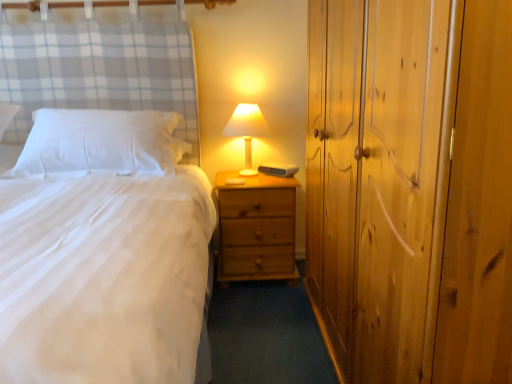
Question: From a real-world perspective, is wooden dresser at right physically above white soft pillow at left?

Choices:
 (A) no
 (B) yes

Answer: (A)

Question: Considering the relative sizes of wooden dresser at right and white soft pillow at left in the image provided, is wooden dresser at right taller than white soft pillow at left?

Choices:
 (A) no
 (B) yes

Answer: (B)

Question: Considering the relative positions of wooden dresser at right and white soft pillow at left in the image provided, is wooden dresser at right in front of white soft pillow at left?

Choices:
 (A) yes
 (B) no

Answer: (A)

Question: From the image's perspective, would you say wooden dresser at right is positioned over white soft pillow at left?

Choices:
 (A) no
 (B) yes

Answer: (A)

Question: Considering the relative sizes of wooden dresser at right and white soft pillow at left in the image provided, is wooden dresser at right shorter than white soft pillow at left?

Choices:
 (A) yes
 (B) no

Answer: (B)

Question: Would you consider wooden dresser at right to be distant from white soft pillow at left?

Choices:
 (A) no
 (B) yes

Answer: (B)

Question: Is natural wood nightstand at center inside matte white lampshade at center?

Choices:
 (A) yes
 (B) no

Answer: (B)

Question: Is the position of matte white lampshade at center less distant than that of natural wood nightstand at center?

Choices:
 (A) no
 (B) yes

Answer: (A)

Question: From the image's perspective, is matte white lampshade at center below natural wood nightstand at center?

Choices:
 (A) no
 (B) yes

Answer: (A)

Question: From a real-world perspective, is matte white lampshade at center positioned over natural wood nightstand at center based on gravity?

Choices:
 (A) no
 (B) yes

Answer: (B)

Question: Does matte white lampshade at center have a smaller size compared to natural wood nightstand at center?

Choices:
 (A) yes
 (B) no

Answer: (A)

Question: From the image's perspective, is matte white lampshade at center above natural wood nightstand at center?

Choices:
 (A) no
 (B) yes

Answer: (B)

Question: Considering the relative sizes of matte white lampshade at center and wooden dresser at right in the image provided, is matte white lampshade at center taller than wooden dresser at right?

Choices:
 (A) no
 (B) yes

Answer: (A)